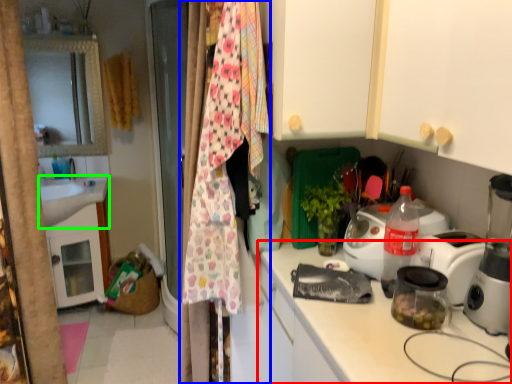
Question: Which object is positioned closest to countertop (highlighted by a red box)? Select from clothesline (highlighted by a blue box) and sink (highlighted by a green box).

Choices:
 (A) clothesline
 (B) sink

Answer: (A)